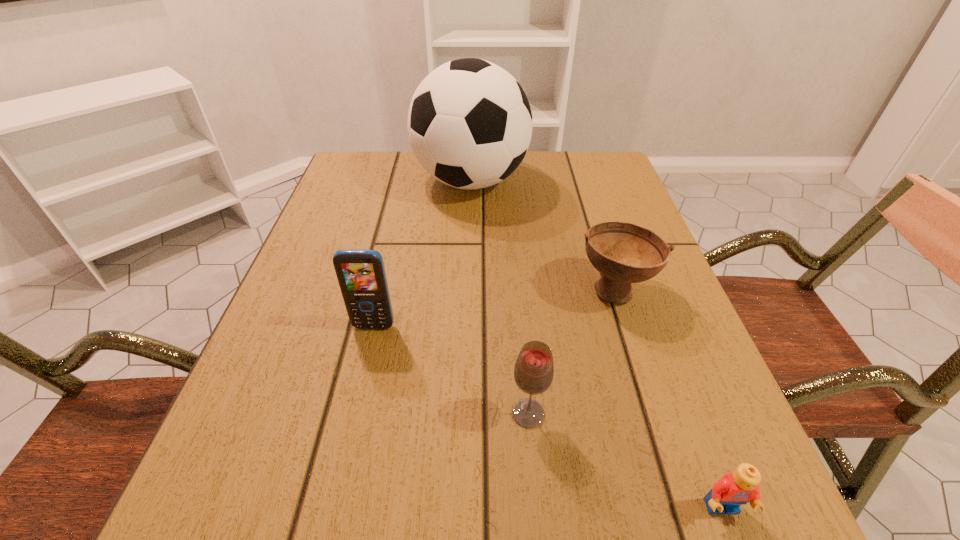
Where is `the farthest object`? The width and height of the screenshot is (960, 540). the farthest object is located at coordinates (470, 123).

I want to click on soccer ball, so click(x=470, y=123).

The height and width of the screenshot is (540, 960). I want to click on cellular telephone, so click(361, 275).

Find the location of a particular element. The image size is (960, 540). the third farthest object is located at coordinates (361, 275).

I want to click on the second nearest object, so click(x=534, y=369).

Where is `the second farthest object`? This screenshot has height=540, width=960. the second farthest object is located at coordinates (624, 253).

Locate an element on the screen. The image size is (960, 540). Lego is located at coordinates (734, 489).

Where is `the shortest object`? the shortest object is located at coordinates (734, 489).

Find the location of `vacant space located 0.180m on the right of the farthest object`. vacant space located 0.180m on the right of the farthest object is located at coordinates (598, 181).

Identify the location of vacant space located 0.240m on the screen of the third farthest object. click(341, 470).